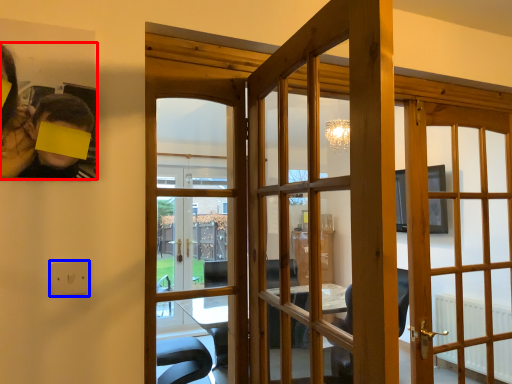
Question: Which of the following is the closest to the observer, houseplant (highlighted by a red box) or electric outlet (highlighted by a blue box)?

Choices:
 (A) houseplant
 (B) electric outlet

Answer: (A)